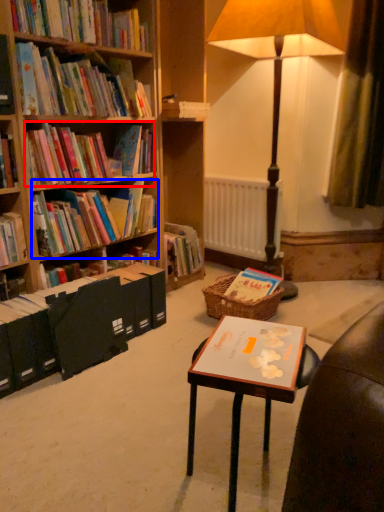
Question: Which of the following is the closest to the observer, book (highlighted by a red box) or book (highlighted by a blue box)?

Choices:
 (A) book
 (B) book

Answer: (A)